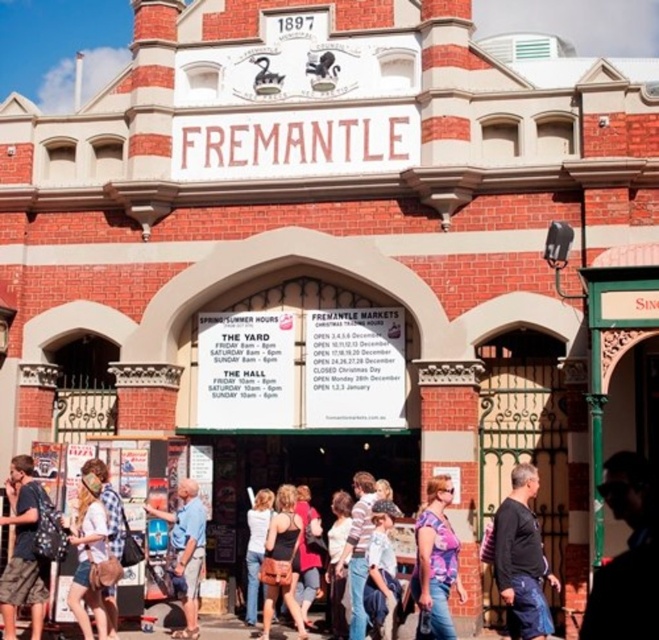
Does denim shorts at lower left come behind denim jacket at center?

Yes, denim shorts at lower left is further from the viewer.

This screenshot has height=640, width=659. What do you see at coordinates (88, 556) in the screenshot?
I see `denim shorts at lower left` at bounding box center [88, 556].

Find the location of a particular element. The width and height of the screenshot is (659, 640). denim shorts at lower left is located at coordinates (88, 556).

From the picture: Which is more to the left, black cotton shirt at right or camouflage shorts at lower left?

camouflage shorts at lower left is more to the left.

Is point (509, 634) behind point (22, 492)?

No, it is not.

Who is more forward, [525,620] or [22,470]?

Point [525,620] is in front.

You are a GUI agent. You are given a task and a screenshot of the screen. Output one action in this format:
    pyautogui.click(x=<x>, y=<y>)
    Task: Click on the black cotton shirt at right
    
    Given the screenshot: What is the action you would take?
    pyautogui.click(x=521, y=557)

Does camouflage shorts at lower left appear over white cotton shirt at center?

Indeed, camouflage shorts at lower left is positioned over white cotton shirt at center.

How much distance is there between camouflage shorts at lower left and white cotton shirt at center?

The distance of camouflage shorts at lower left from white cotton shirt at center is 11.15 meters.

Is point (45, 592) positioned before point (252, 573)?

That is True.

Image resolution: width=659 pixels, height=640 pixels. What are the coordinates of `camouflage shorts at lower left` in the screenshot? It's located at (22, 548).